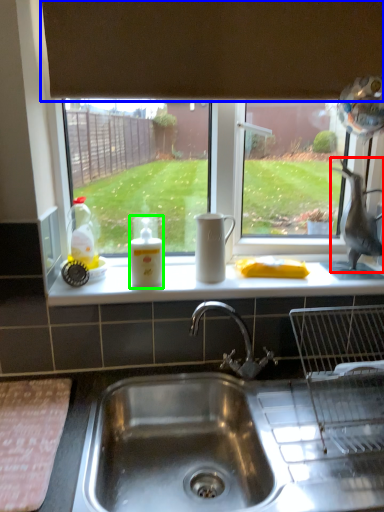
Question: Which is farther away from animal (highlighted by a red box)? exhaust hood (highlighted by a blue box) or bottle (highlighted by a green box)?

Choices:
 (A) exhaust hood
 (B) bottle

Answer: (B)